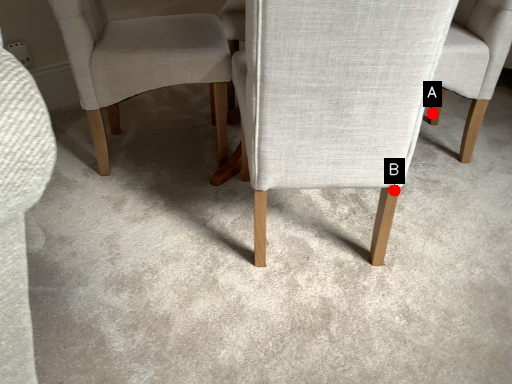
Question: Two points are circled on the image, labeled by A and B beside each circle. Which point is closer to the camera?

Choices:
 (A) A is closer
 (B) B is closer

Answer: (B)